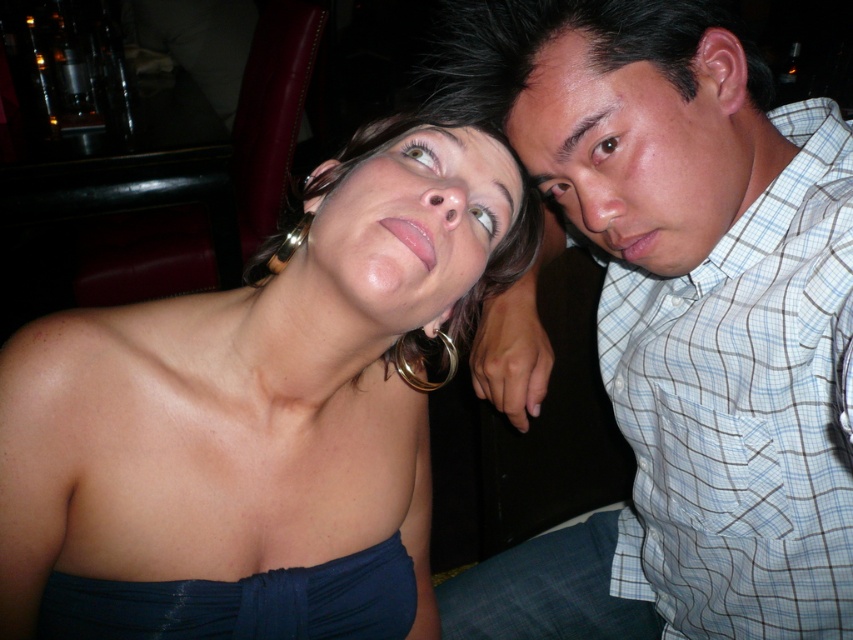
Can you confirm if shiny blue dress at center is bigger than blue plaid shirt at upper right?

Yes.

Between point (125, 316) and point (762, 301), which one is positioned in front?

Point (125, 316) is more forward.

At what (x,y) coordinates should I click in order to perform the action: click on shiny blue dress at center. Please return your answer as a coordinate pair (x, y). Looking at the image, I should click on (258, 417).

Who is lower down, blue plaid shirt at upper right or matte plaid shirt at upper right?

blue plaid shirt at upper right

Between blue plaid shirt at upper right and matte plaid shirt at upper right, which one is positioned higher?

matte plaid shirt at upper right is above.

This screenshot has height=640, width=853. Find the location of `blue plaid shirt at upper right`. blue plaid shirt at upper right is located at coordinates (743, 408).

Does matte plaid shirt at upper right lie in front of matte skin face at upper center?

No, matte plaid shirt at upper right is further to the viewer.

Between point (592, 225) and point (457, 317), which one is positioned behind?

Positioned behind is point (457, 317).

This screenshot has width=853, height=640. What are the coordinates of `matte plaid shirt at upper right` in the screenshot? It's located at (640, 147).